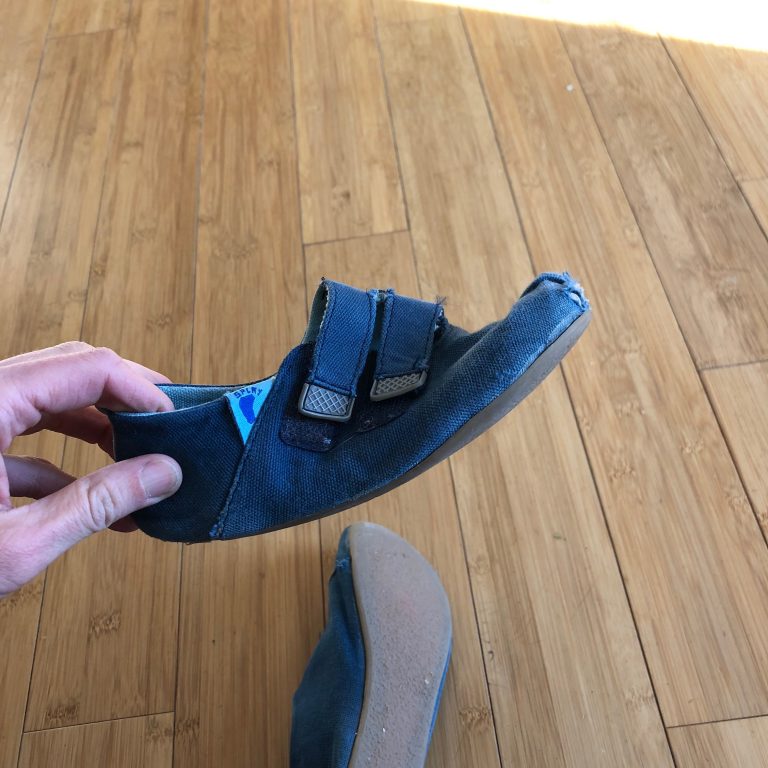
Find the location of a particular element. The image size is (768, 768). hardwood floor is located at coordinates (382, 141).